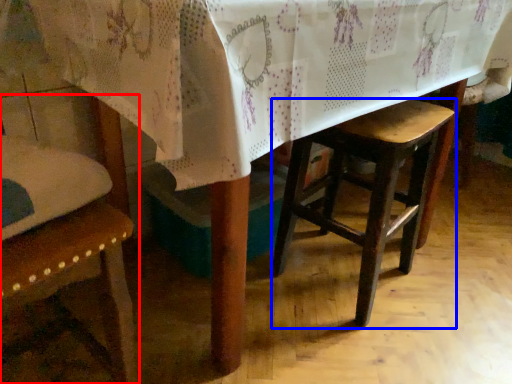
Question: Among these objects, which one is farthest to the camera, chair (highlighted by a red box) or stool (highlighted by a blue box)?

Choices:
 (A) chair
 (B) stool

Answer: (B)